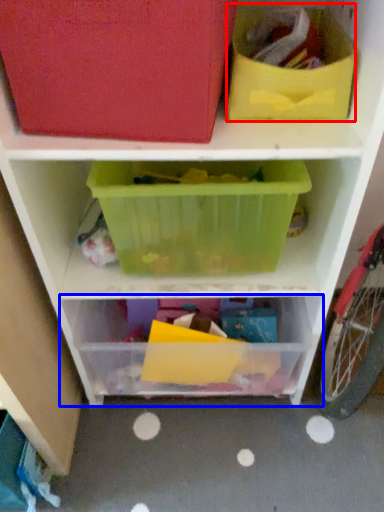
Question: Which point is closer to the camera, storage box (highlighted by a red box) or shelf (highlighted by a blue box)?

Choices:
 (A) storage box
 (B) shelf

Answer: (A)